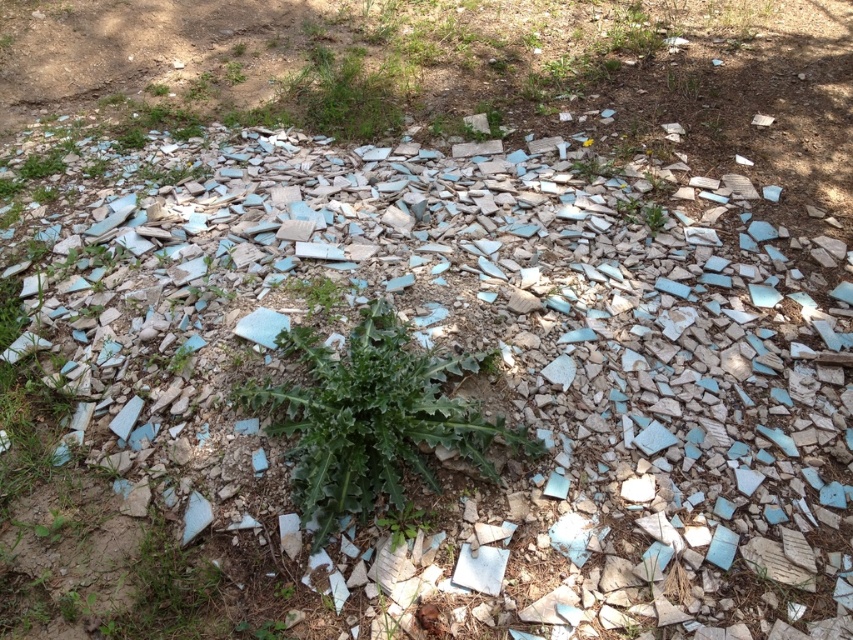
Does point (134, 580) come closer to viewer compared to point (596, 170)?

Yes, it is in front of point (596, 170).

Does green leafy plant at lower left have a greater width compared to green leafy plant at upper center?

Correct, the width of green leafy plant at lower left exceeds that of green leafy plant at upper center.

Is point (136, 556) closer to camera compared to point (589, 170)?

Yes, point (136, 556) is closer to viewer.

Where is `green leafy plant at lower left`? This screenshot has height=640, width=853. green leafy plant at lower left is located at coordinates (165, 589).

Between green leafy plant at center and green leafy plant at lower left, which one is positioned higher?

green leafy plant at center is above.

Can you confirm if green leafy plant at center is positioned to the right of green leafy plant at lower left?

Indeed, green leafy plant at center is positioned on the right side of green leafy plant at lower left.

Does point (379, 328) come in front of point (154, 536)?

No, it is behind (154, 536).

I want to click on green leafy plant at center, so click(x=372, y=419).

What do you see at coordinates (372, 419) in the screenshot?
I see `green leafy plant at center` at bounding box center [372, 419].

Does point (339, 476) come closer to viewer compared to point (613, 170)?

Yes, point (339, 476) is in front of point (613, 170).

Where is `green leafy plant at center`? The height and width of the screenshot is (640, 853). green leafy plant at center is located at coordinates (372, 419).